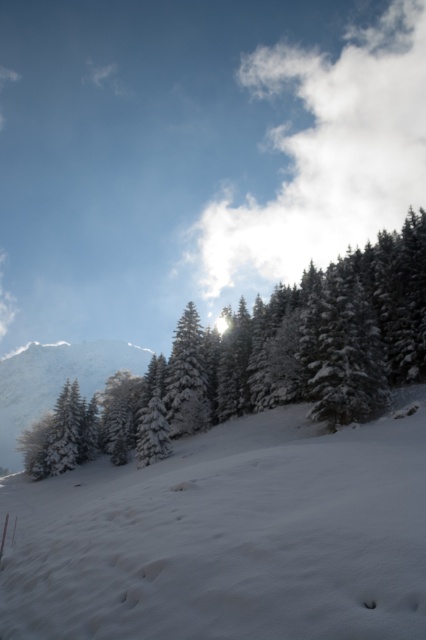
You are an observer standing at the bottom of the snowy hill. You see the white snow at lower left and the white frosty mountain at left. Which one appears taller from your current viewpoint?

The white frosty mountain at left appears taller than the white snow at lower left because the white snow at lower left is not as tall as the mountain.

You are an explorer navigating a winter landscape. You see the white snow at lower left and the white frosty mountain at left. Which of these two landmarks is positioned more to the left side of the image?

The white frosty mountain at left is more to the left because the white snow at lower left is located to its right side.